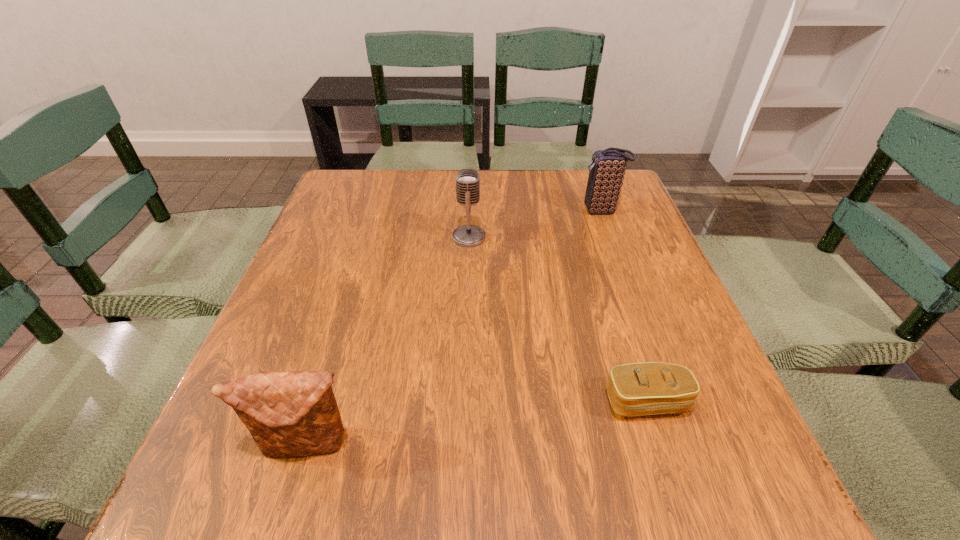
This screenshot has height=540, width=960. I want to click on free spot at the far left corner of the desktop, so click(x=338, y=177).

In the image, there is a desktop. Where is `free space at the near right corner`? The width and height of the screenshot is (960, 540). free space at the near right corner is located at coordinates (683, 472).

You are a GUI agent. You are given a task and a screenshot of the screen. Output one action in this format:
    pyautogui.click(x=<x>, y=<y>)
    Task: Click on the vacant space that is in between the farthest object and the leftmost clutch bag
    
    Given the screenshot: What is the action you would take?
    pyautogui.click(x=454, y=328)

Locate an element on the screen. This screenshot has height=540, width=960. free spot between the second farthest clutch bag and the third object from right to left is located at coordinates (558, 319).

The image size is (960, 540). What are the coordinates of `empty space between the second farthest object and the leftmost object` in the screenshot? It's located at (388, 341).

Where is `free spot between the farthest object and the third nearest object`? free spot between the farthest object and the third nearest object is located at coordinates (535, 224).

This screenshot has height=540, width=960. Identify the location of empty space that is in between the farthest clutch bag and the third object from right to left. (535, 224).

Identify the location of free space between the nearest object and the second nearest clutch bag. 477,423.

This screenshot has width=960, height=540. What are the coordinates of `free space between the second farthest clutch bag and the farthest clutch bag` in the screenshot? It's located at (624, 306).

I want to click on empty space between the farthest clutch bag and the shortest clutch bag, so click(624, 306).